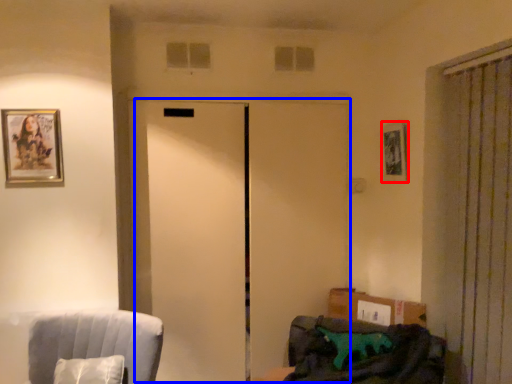
Question: Which object appears farthest to the camera in this image, picture frame (highlighted by a red box) or elevator (highlighted by a blue box)?

Choices:
 (A) picture frame
 (B) elevator

Answer: (A)